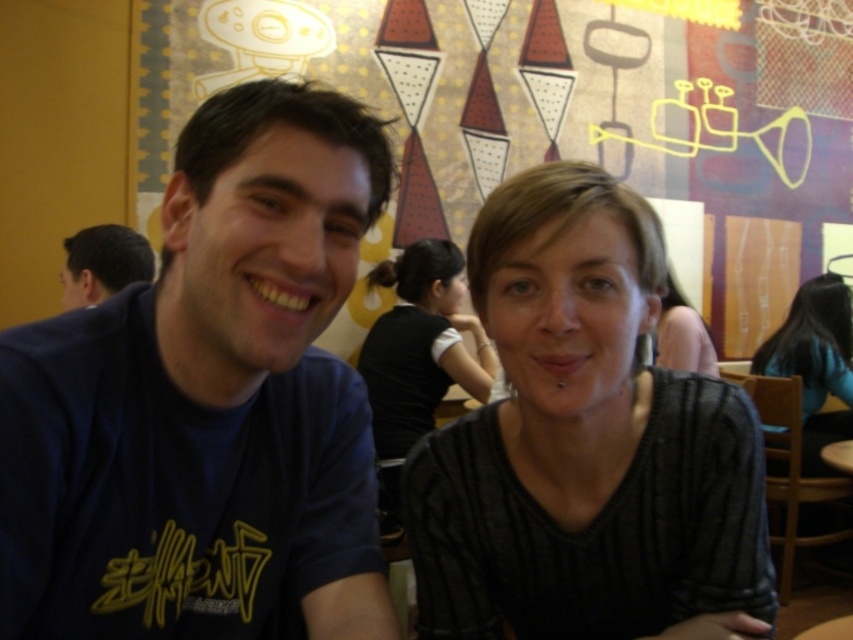
Consider the image. You are a photographer trying to capture both the matte black sweater at center and the matte black shirt at center in a single frame. Since they are both centered, will the sweater appear larger in the photo compared to the shirt?

The matte black sweater at center is taller than the matte black shirt at center, so yes, the sweater will appear larger in the photo compared to the shirt.

You are a photographer standing in front of the two people in the image. You notice both the matte black sweater at center and the matte black shirt at center. Which one is positioned lower on their body?

The matte black sweater at center is located below the matte black shirt at center, so the sweater is positioned lower on their body.